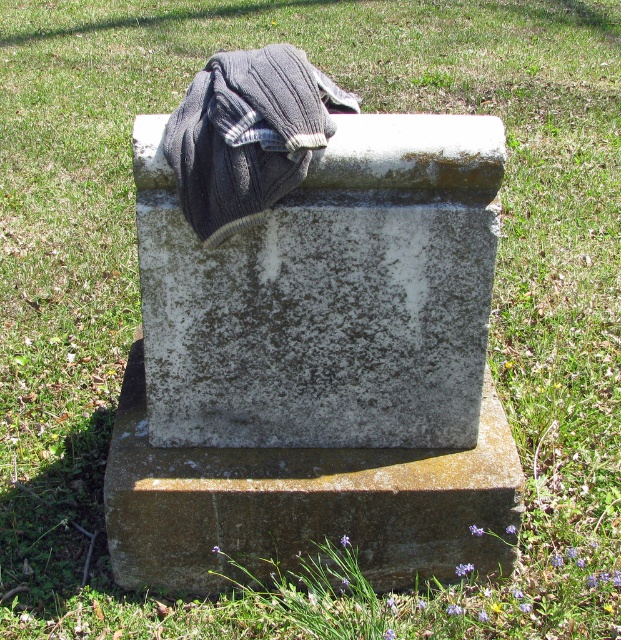
Is gray stone gravestone at center in front of gray knitted blanket at upper center?

No, gray stone gravestone at center is further to the viewer.

Can you confirm if gray stone gravestone at center is wider than gray knitted blanket at upper center?

Yes, gray stone gravestone at center is wider than gray knitted blanket at upper center.

Does point (193, 234) come in front of point (230, 108)?

No, it is behind (230, 108).

Find the location of a particular element. This screenshot has height=640, width=621. gray stone gravestone at center is located at coordinates (319, 368).